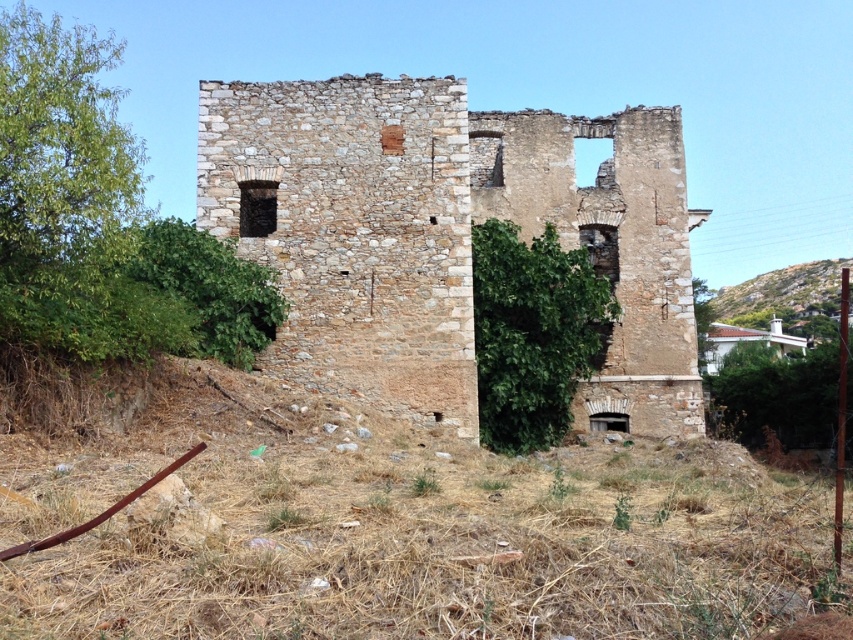
Looking at this image, measure the distance from rustic stone ruins at center to green grassy hillside at right.

rustic stone ruins at center is 63.09 meters away from green grassy hillside at right.

Which is in front, point (235, 125) or point (827, 285)?

Positioned in front is point (235, 125).

Image resolution: width=853 pixels, height=640 pixels. What do you see at coordinates (445, 236) in the screenshot?
I see `rustic stone ruins at center` at bounding box center [445, 236].

Find the location of a particular element. Image resolution: width=853 pixels, height=640 pixels. rustic stone ruins at center is located at coordinates (445, 236).

Can you confirm if green leafy bush at center is bigger than green grassy hillside at right?

No.

Which of these two, green leafy bush at center or green grassy hillside at right, stands taller?

green leafy bush at center

Does point (503, 289) come behind point (746, 324)?

That is False.

Locate an element on the screen. This screenshot has height=640, width=853. green leafy bush at center is located at coordinates (532, 333).

Which of these two, rustic stone ruins at center or green leafy bush at center, stands taller?

rustic stone ruins at center

Can you confirm if rustic stone ruins at center is positioned to the right of green leafy bush at center?

No, rustic stone ruins at center is not to the right of green leafy bush at center.

The height and width of the screenshot is (640, 853). What do you see at coordinates (445, 236) in the screenshot?
I see `rustic stone ruins at center` at bounding box center [445, 236].

I want to click on rustic stone ruins at center, so click(x=445, y=236).